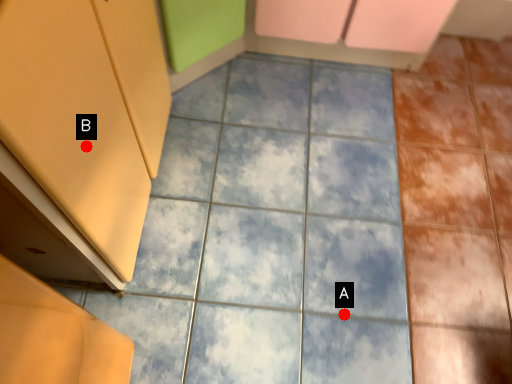
Question: Two points are circled on the image, labeled by A and B beside each circle. Which of the following is the closest to the observer?

Choices:
 (A) A is closer
 (B) B is closer

Answer: (B)